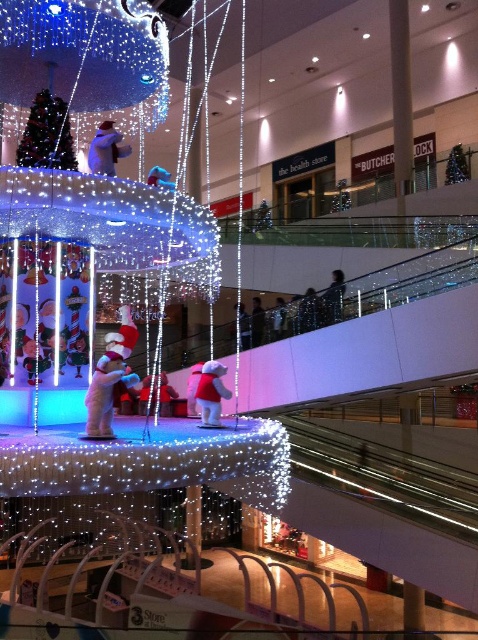
Between smooth skin person at center and white plush bear at center, which one has more height?

Standing taller between the two is smooth skin person at center.

Is smooth skin person at center in front of white plush bear at center?

No, it is behind white plush bear at center.

At what (x,y) coordinates should I click in order to perform the action: click on smooth skin person at center. Please return your answer as a coordinate pair (x, y). This screenshot has height=640, width=478. Looking at the image, I should click on (290, 314).

The height and width of the screenshot is (640, 478). What are the coordinates of `smooth skin person at center` in the screenshot? It's located at (x=290, y=314).

Is matte white santa at center smaller than matte red plush bear at center?

Indeed, matte white santa at center has a smaller size compared to matte red plush bear at center.

Is matte white santa at center above matte red plush bear at center?

Incorrect, matte white santa at center is not positioned above matte red plush bear at center.

Measure the distance between matte white santa at center and camera.

The distance of matte white santa at center from camera is 6.07 meters.

You are a GUI agent. You are given a task and a screenshot of the screen. Output one action in this format:
    pyautogui.click(x=<x>, y=<y>)
    Task: Click on the matte white santa at center
    
    Given the screenshot: What is the action you would take?
    pyautogui.click(x=110, y=378)

Is matte red plush bear at center to the right of white plush bear at center from the viewer's perspective?

Indeed, matte red plush bear at center is positioned on the right side of white plush bear at center.

Between matte red plush bear at center and white plush bear at center, which one has more height?

white plush bear at center

What do you see at coordinates (210, 394) in the screenshot? I see `matte red plush bear at center` at bounding box center [210, 394].

Locate an element on the screen. This screenshot has width=478, height=640. matte red plush bear at center is located at coordinates tap(210, 394).